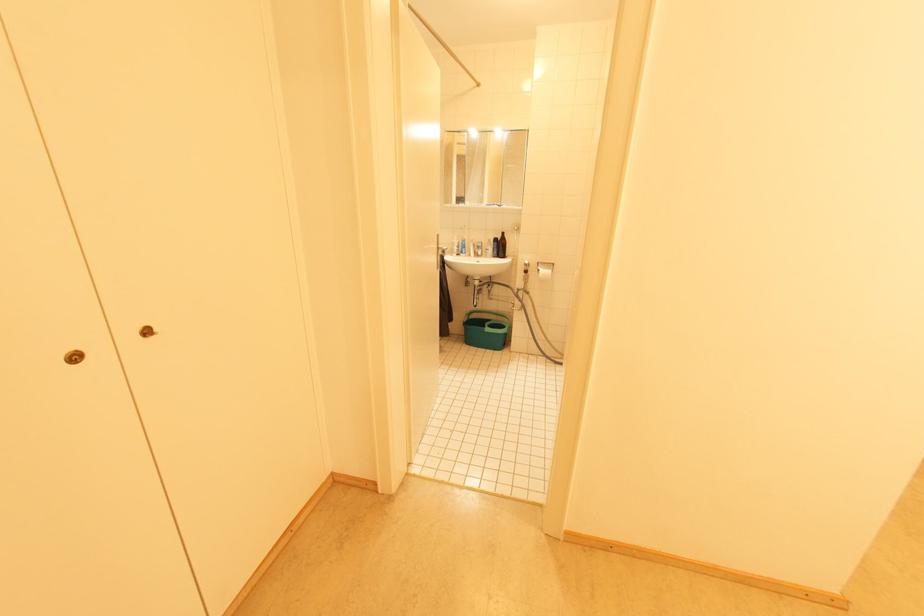
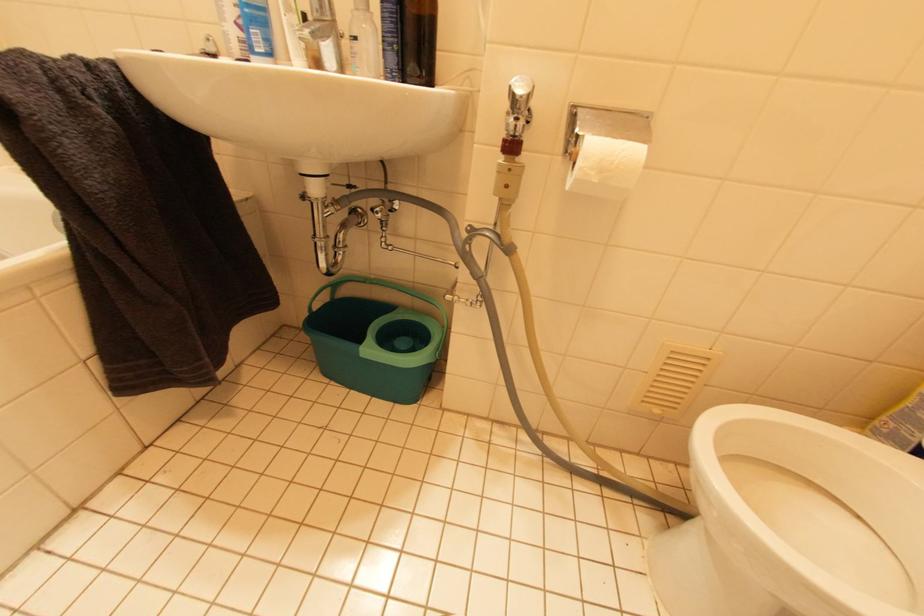
Question: Which direction would the cameraman need to move to produce the second image? Reply with the corresponding letter.

Choices:
 (A) Left
 (B) Right
 (C) Forward
 (D) Backward

Answer: (C)